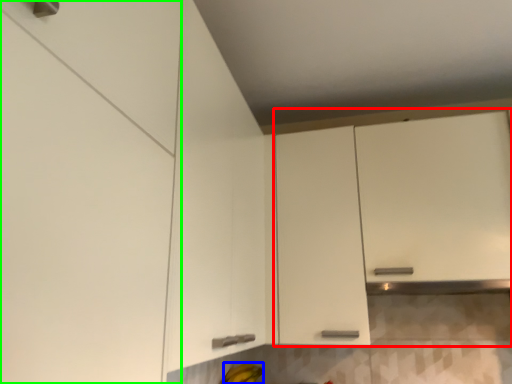
Question: Which object is the closest to the cabinetry (highlighted by a red box)? Choose among these: banana (highlighted by a blue box) or cabinetry (highlighted by a green box).

Choices:
 (A) banana
 (B) cabinetry

Answer: (A)